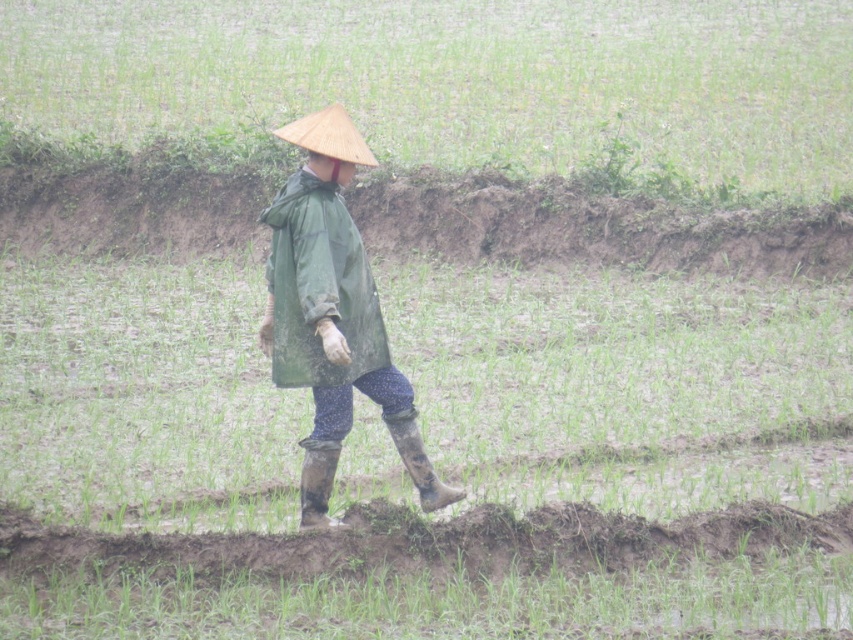
Does point (526, 528) come in front of point (412, 438)?

Yes, point (526, 528) is in front of point (412, 438).

Is point (233, 573) more distant than point (428, 468)?

No, it is in front of (428, 468).

Identify the location of brown muddy soil at center. Image resolution: width=853 pixels, height=640 pixels. (428, 541).

Can you confirm if green matte raincoat at center is positioned below rubber/muddy boot at center?

Incorrect, green matte raincoat at center is not positioned below rubber/muddy boot at center.

What do you see at coordinates (332, 314) in the screenshot? This screenshot has height=640, width=853. I see `green matte raincoat at center` at bounding box center [332, 314].

Which is in front, point (405, 452) or point (321, 461)?

Point (321, 461)

Locate an element on the screen. The width and height of the screenshot is (853, 640). green matte raincoat at center is located at coordinates (332, 314).

From the picture: Can you confirm if green matte field at center is positioned below green matte raincoat at center?

Incorrect, green matte field at center is not positioned below green matte raincoat at center.

Does green matte field at center have a lesser height compared to green matte raincoat at center?

No.

Which is in front, point (740, 54) or point (320, 474)?

Point (320, 474) is more forward.

The image size is (853, 640). In order to click on green matte field at center in this screenshot , I will do `click(457, 77)`.